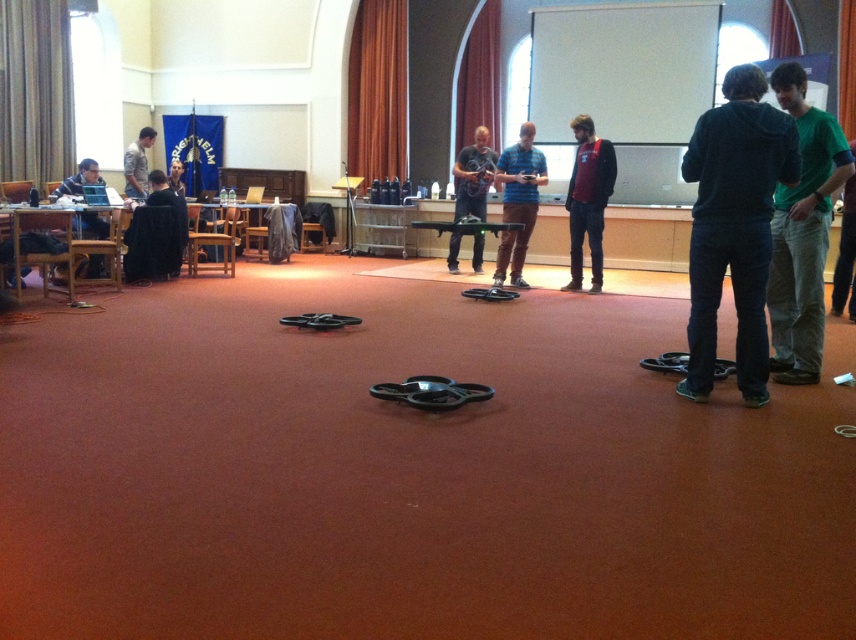
You are a participant in the conference and you see the blue striped shirt at center and the smooth black jacket at center. Which one is closer to the floor?

The blue striped shirt at center is positioned under the smooth black jacket at center, so the blue striped shirt at center is closer to the floor.

You are standing in the conference room and want to pick up the drone closest to you. There are two points marked on the floor where drones are located. Which point should you go to, point (535, 209) or point (179, 180)?

You should go to point (535, 209) because it is closer to you than point (179, 180).

You are a photographer in the conference room. You need to capture a photo of the blue striped shirt at center and the smooth black jacket at center. Which one will appear larger in the photo?

The blue striped shirt at center will appear larger in the photo because it is taller than the smooth black jacket at center.